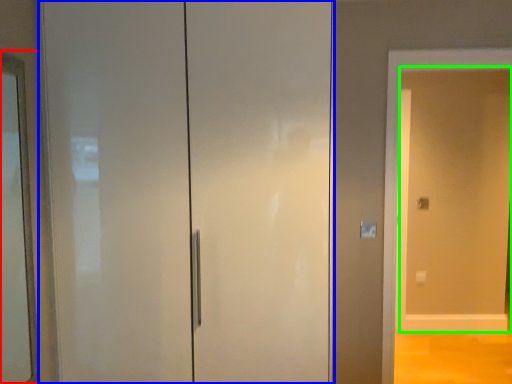
Question: Based on their relative distances, which object is nearer to mirror (highlighted by a red box)? Choose from door (highlighted by a blue box) and screen door (highlighted by a green box).

Choices:
 (A) door
 (B) screen door

Answer: (A)